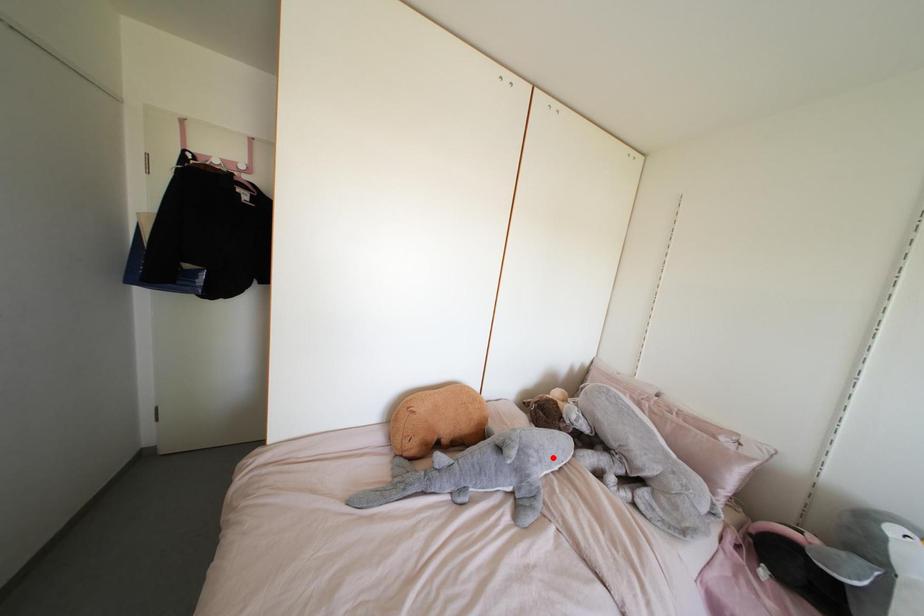
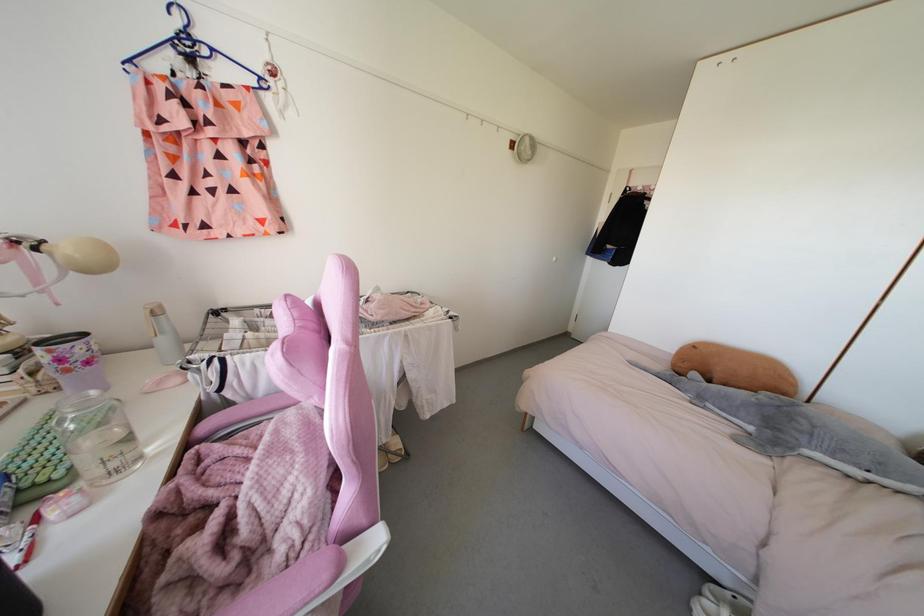
Question: I am providing you with two images of the same scene from different viewpoints. A red point is marked on the first image. Can you still see the location of the red point in image 2?

Choices:
 (A) Yes
 (B) No

Answer: (A)